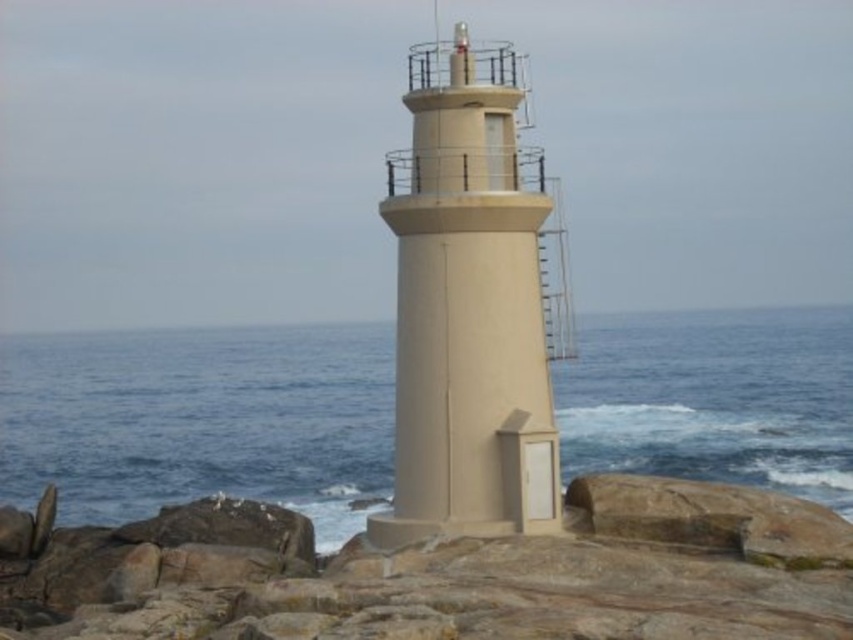
Question: Considering the real-world distances, which object is closest to the beige concrete tower at center?

Choices:
 (A) blue water at center
 (B) brown rock at center

Answer: (B)

Question: Which object is closer to the camera taking this photo?

Choices:
 (A) brown rock at center
 (B) beige concrete tower at center

Answer: (A)

Question: Which of the following is the closest to the observer?

Choices:
 (A) beige concrete tower at center
 (B) brown rock at center

Answer: (B)

Question: Is blue water at center to the right of brown rock at center from the viewer's perspective?

Choices:
 (A) yes
 (B) no

Answer: (B)

Question: Is blue water at center to the right of beige concrete tower at center from the viewer's perspective?

Choices:
 (A) yes
 (B) no

Answer: (B)

Question: Does brown rock at center come behind beige concrete tower at center?

Choices:
 (A) yes
 (B) no

Answer: (B)